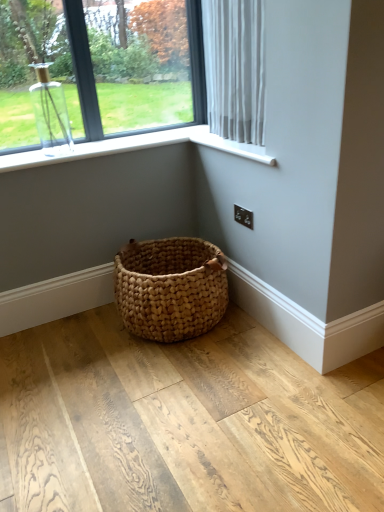
Question: Is point (221, 14) positioned closer to the camera than point (107, 15)?

Choices:
 (A) closer
 (B) farther

Answer: (A)

Question: In terms of size, does white sheer curtain at upper right appear bigger or smaller than clear glass vase at upper left?

Choices:
 (A) big
 (B) small

Answer: (A)

Question: Considering the real-world distances, which object is farthest from the white plastic window sill at upper right?

Choices:
 (A) white sheer curtain at upper right
 (B) clear glass vase at upper left

Answer: (B)

Question: Considering the real-world distances, which object is farthest from the white sheer curtain at upper right?

Choices:
 (A) white plastic window sill at upper right
 (B) clear glass vase at upper left

Answer: (B)